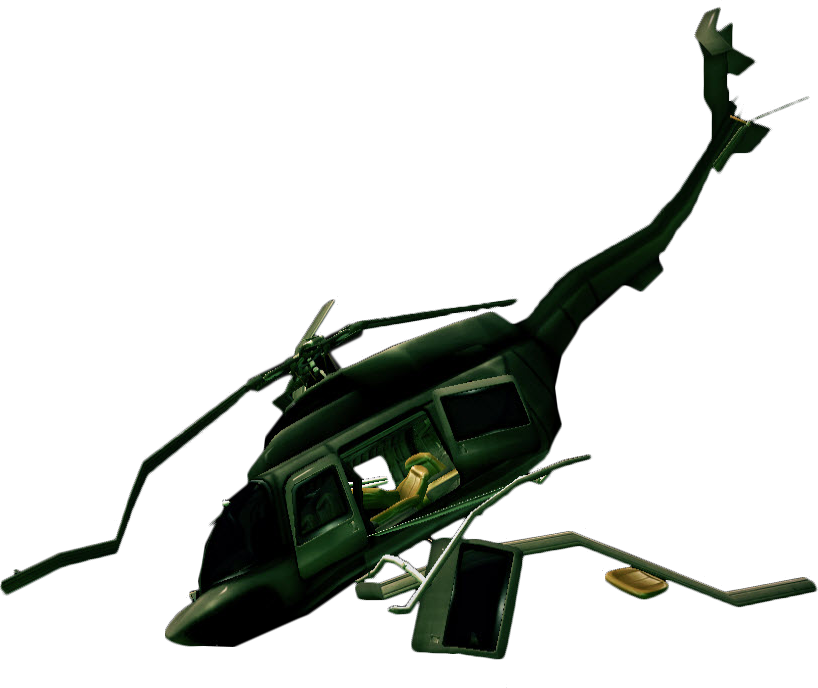
Find the location of a particular element. The height and width of the screenshot is (688, 818). window is located at coordinates (315, 504), (490, 407), (246, 526).